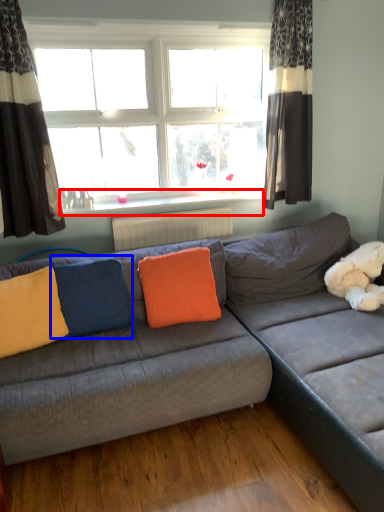
Question: Which point is further to the camera, window sill (highlighted by a red box) or pillow (highlighted by a blue box)?

Choices:
 (A) window sill
 (B) pillow

Answer: (A)